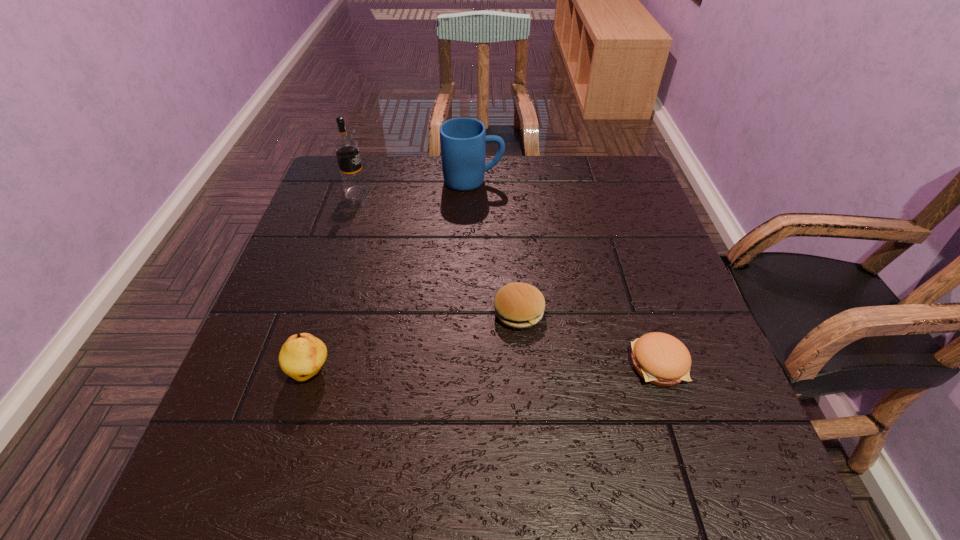
You are a GUI agent. You are given a task and a screenshot of the screen. Output one action in this format:
    pyautogui.click(x=<x>, y=<y>)
    Task: Click on the free space that satisfies the following two spatial constraints: 1. on the side of the right patty with the handle; 2. on the right side of the second tallest object
    
    Given the screenshot: What is the action you would take?
    pyautogui.click(x=469, y=364)

Where is `vacant region that satisfies the following two spatial constraints: 1. on the label of the right patty; 2. on the left side of the vodka`? Image resolution: width=960 pixels, height=540 pixels. vacant region that satisfies the following two spatial constraints: 1. on the label of the right patty; 2. on the left side of the vodka is located at coordinates (300, 364).

Locate an element on the screen. Image resolution: width=960 pixels, height=540 pixels. free region that satisfies the following two spatial constraints: 1. on the side of the farther patty with the handle; 2. on the right side of the fourth shortest object is located at coordinates 470,312.

What are the coordinates of `free space that satisfies the following two spatial constraints: 1. on the label of the vodka; 2. on the left side of the farther patty` in the screenshot? It's located at (317, 312).

Locate an element on the screen. The image size is (960, 540). free spot that satisfies the following two spatial constraints: 1. on the label of the right patty; 2. on the left side of the vodka is located at coordinates (300, 364).

Locate an element on the screen. vacant space that satisfies the following two spatial constraints: 1. on the back side of the third tallest object; 2. on the left side of the nearer patty is located at coordinates (313, 364).